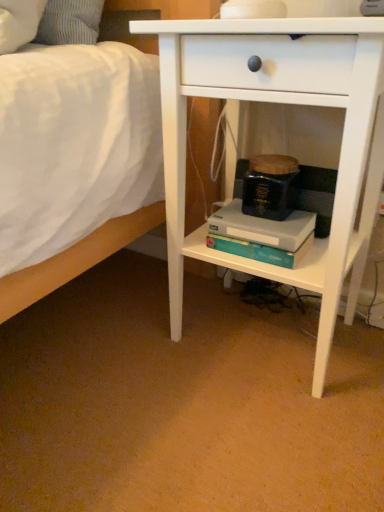
The width and height of the screenshot is (384, 512). Identify the location of free location in front of teal matte paperback book at center, which is the 1th paperback book in top-to-bottom order. (270, 226).